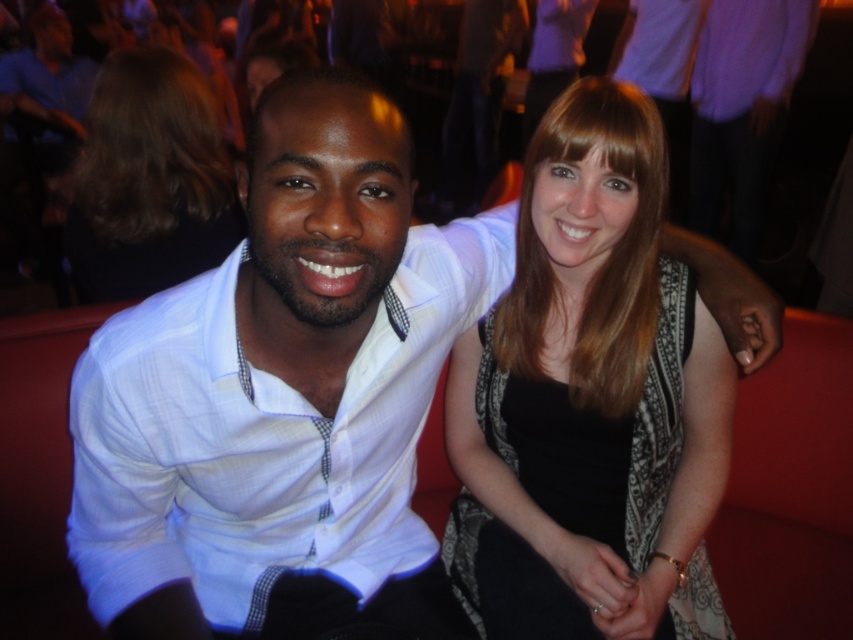
You are a photographer adjusting your camera settings for a closeup shot of the black textured dress at center. To ensure the dress is in focus, where should you position your camera relative to the dress?

The black textured dress at center is located at point (585,397), so the camera should be positioned directly facing that coordinate to ensure the dress is in focus.

You are a photographer trying to capture a photo of the black textured dress at center and the white textured shirt at left. Which object should you focus on first if you want to ensure both are in focus, considering their sizes in the frame?

The black textured dress at center is much taller than the white textured shirt at left, so focusing on the larger object first would help ensure both are in focus.